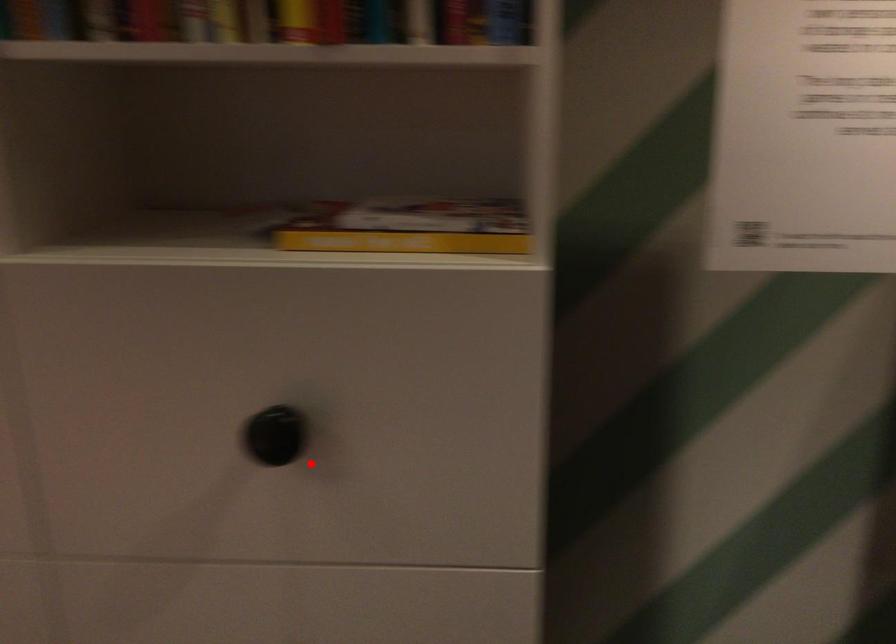
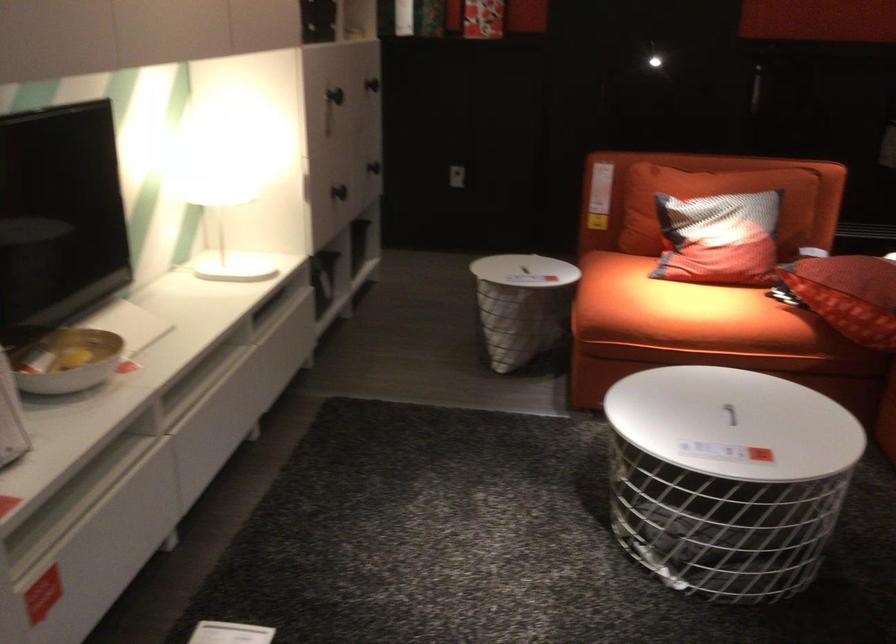
Question: A red point is marked in image1. In image2, is the corresponding 3D point closer to the camera or farther? Reply with the corresponding letter.

Choices:
 (A) The corresponding 3D point is closer.
 (B) The corresponding 3D point is farther.

Answer: (B)